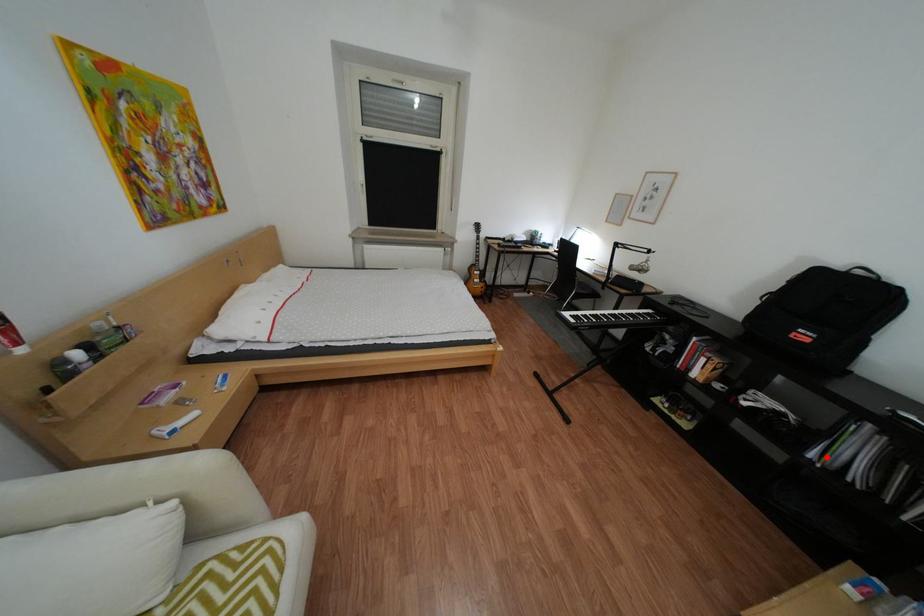
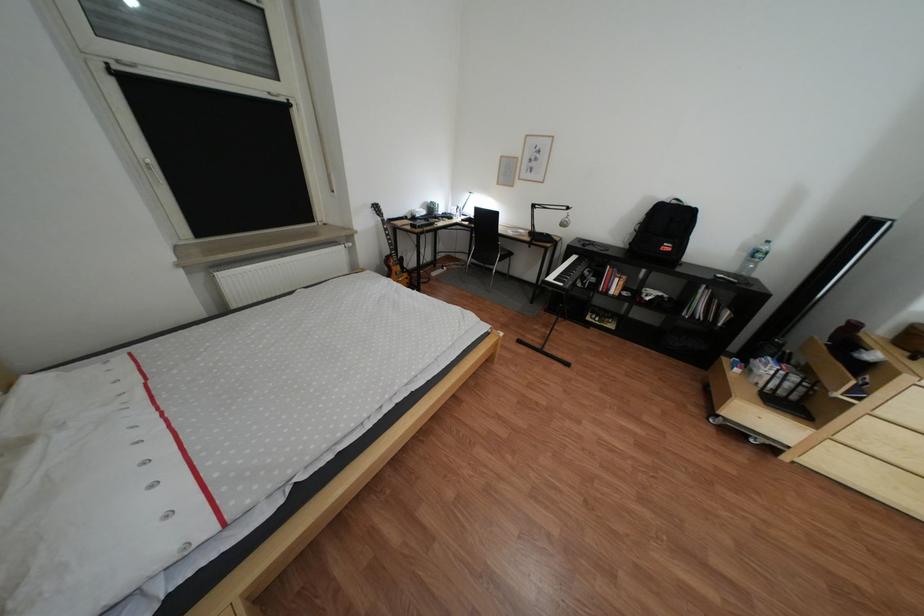
The point at the highlighted location is marked in the first image. Where is the corresponding point in the second image?

(699, 315)